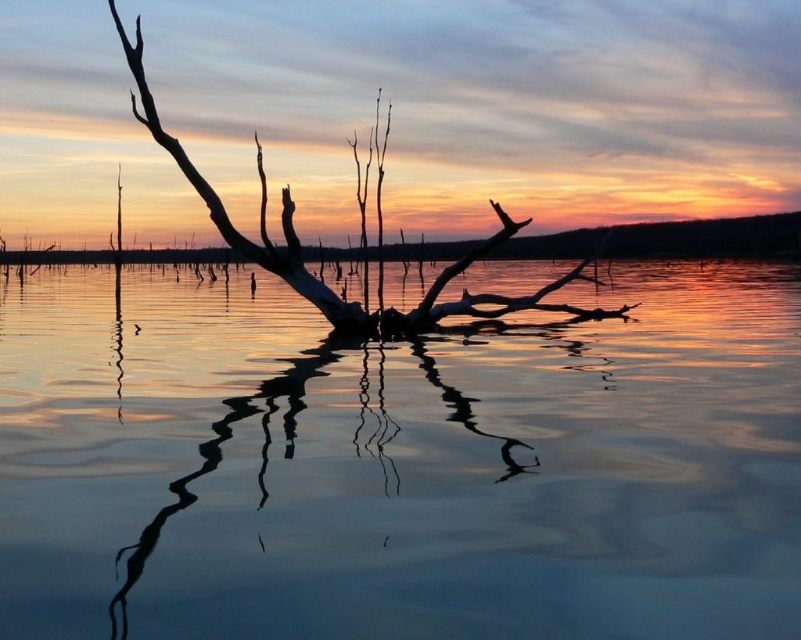
Question: Which of these objects is positioned farthest from the transparent water at center?

Choices:
 (A) silvery wood branch at center
 (B) smooth water reflection at center

Answer: (B)

Question: Does silvery wood branch at center have a greater width compared to smooth water reflection at center?

Choices:
 (A) no
 (B) yes

Answer: (B)

Question: Can you confirm if transparent water at center is bigger than silvery wood branch at center?

Choices:
 (A) no
 (B) yes

Answer: (B)

Question: Does silvery wood branch at center appear over smooth water reflection at center?

Choices:
 (A) yes
 (B) no

Answer: (A)

Question: Which point is closer to the camera?

Choices:
 (A) transparent water at center
 (B) silvery wood branch at center
 (C) smooth water reflection at center

Answer: (A)

Question: Which point is farther from the camera taking this photo?

Choices:
 (A) (188, 490)
 (B) (324, 369)
 (C) (457, 312)

Answer: (C)